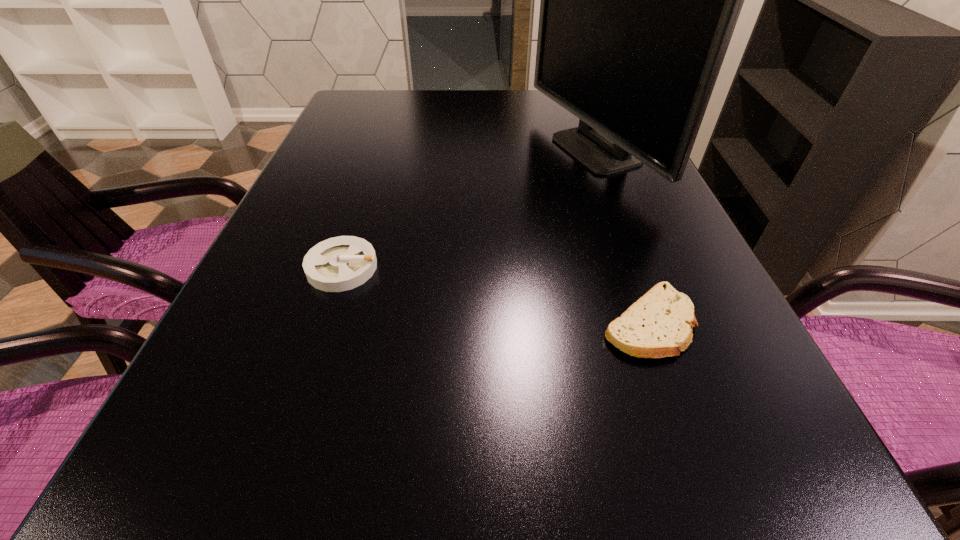
Locate which object is the closest to the computer monitor. Please provide its 2D coordinates. Your answer should be formatted as a tuple, i.e. [(x, y)], where the tuple contains the x and y coordinates of a point satisfying the conditions above.

[(655, 326)]

You are a GUI agent. You are given a task and a screenshot of the screen. Output one action in this format:
    pyautogui.click(x=<x>, y=<y>)
    Task: Click on the vacant space that satisfies the following two spatial constraints: 1. on the front-facing side of the farthest object; 2. on the front side of the leftmost object
    Image resolution: width=960 pixels, height=540 pixels.
    Given the screenshot: What is the action you would take?
    pyautogui.click(x=634, y=267)